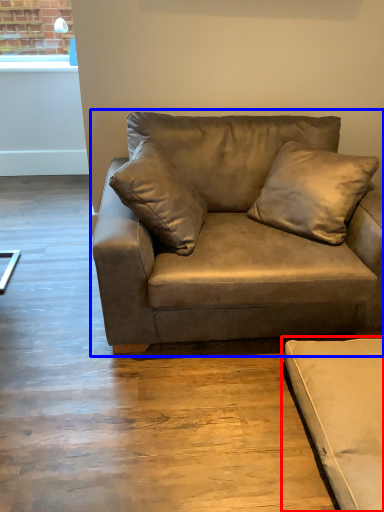
Question: Which point is closer to the camera, studio couch (highlighted by a red box) or studio couch (highlighted by a blue box)?

Choices:
 (A) studio couch
 (B) studio couch

Answer: (A)